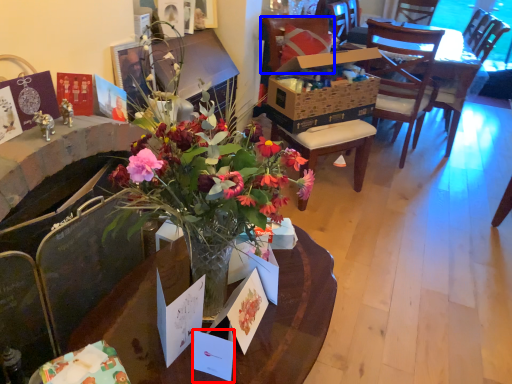
Question: Which object is further to the camera taking this photo, postcard (highlighted by a red box) or chair (highlighted by a blue box)?

Choices:
 (A) postcard
 (B) chair

Answer: (B)